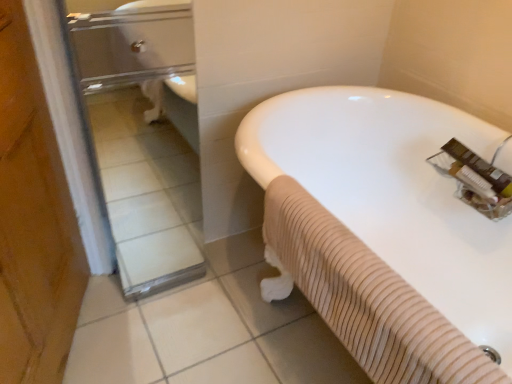
Question: Would you say clear glass door at left is part of white rubber bathtub at center's contents?

Choices:
 (A) no
 (B) yes

Answer: (A)

Question: Is white rubber bathtub at center placed right next to clear glass door at left?

Choices:
 (A) no
 (B) yes

Answer: (A)

Question: Is the position of white rubber bathtub at center less distant than that of clear glass door at left?

Choices:
 (A) no
 (B) yes

Answer: (B)

Question: Is white rubber bathtub at center at the left side of clear glass door at left?

Choices:
 (A) yes
 (B) no

Answer: (B)

Question: Is white rubber bathtub at center facing away from clear glass door at left?

Choices:
 (A) yes
 (B) no

Answer: (B)

Question: Is white rubber bathtub at center shorter than clear glass door at left?

Choices:
 (A) no
 (B) yes

Answer: (B)

Question: Is clear glass door at left to the right of white rubber bathtub at center from the viewer's perspective?

Choices:
 (A) no
 (B) yes

Answer: (A)

Question: From a real-world perspective, is clear glass door at left beneath white rubber bathtub at center?

Choices:
 (A) yes
 (B) no

Answer: (B)

Question: Is clear glass door at left taller than white rubber bathtub at center?

Choices:
 (A) yes
 (B) no

Answer: (A)

Question: Considering the relative sizes of clear glass door at left and white rubber bathtub at center in the image provided, is clear glass door at left wider than white rubber bathtub at center?

Choices:
 (A) no
 (B) yes

Answer: (A)

Question: Does clear glass door at left have a lesser height compared to white rubber bathtub at center?

Choices:
 (A) no
 (B) yes

Answer: (A)

Question: Can you confirm if clear glass door at left is bigger than white rubber bathtub at center?

Choices:
 (A) no
 (B) yes

Answer: (A)

Question: Considering the positions of white rubber bathtub at center and clear glass door at left in the image, is white rubber bathtub at center taller or shorter than clear glass door at left?

Choices:
 (A) short
 (B) tall

Answer: (A)